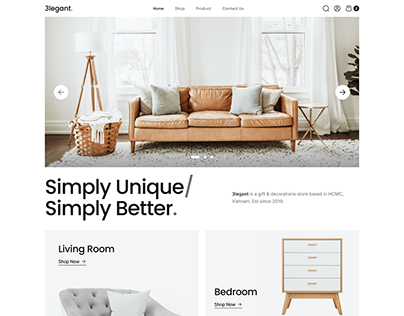
Locate an element on the screen. chair is located at coordinates (97, 297).